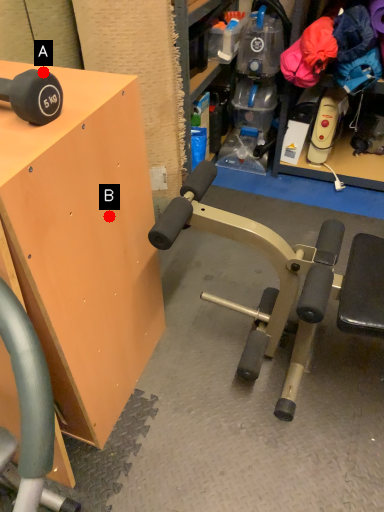
Question: Two points are circled on the image, labeled by A and B beside each circle. Which point is closer to the camera?

Choices:
 (A) A is closer
 (B) B is closer

Answer: (A)